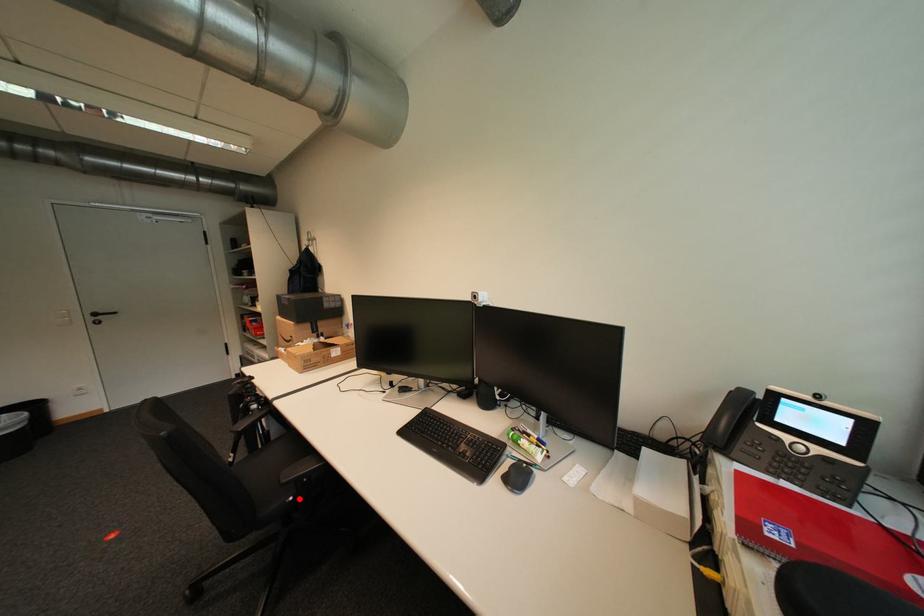
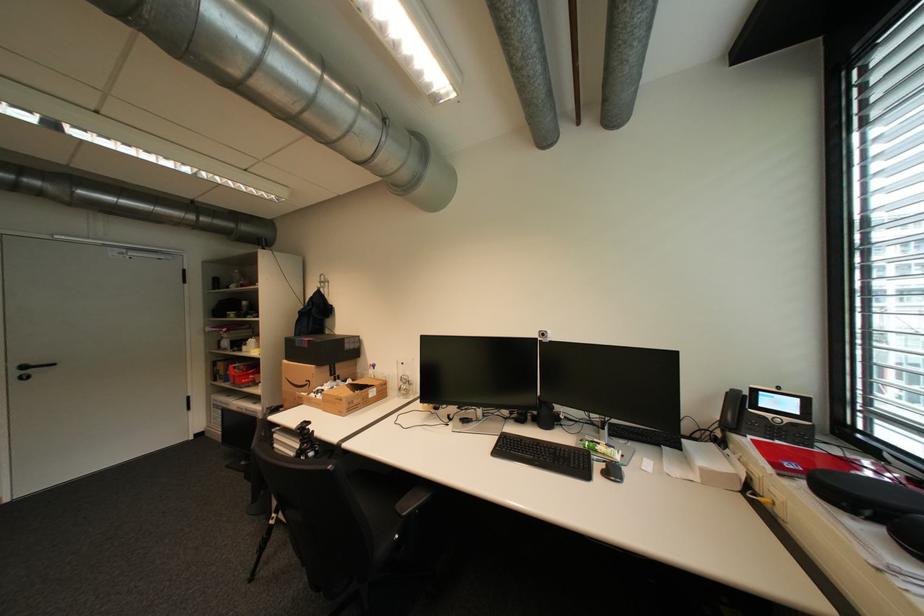
The point at the highlighted location is marked in the first image. Where is the corresponding point in the second image?

(406, 537)